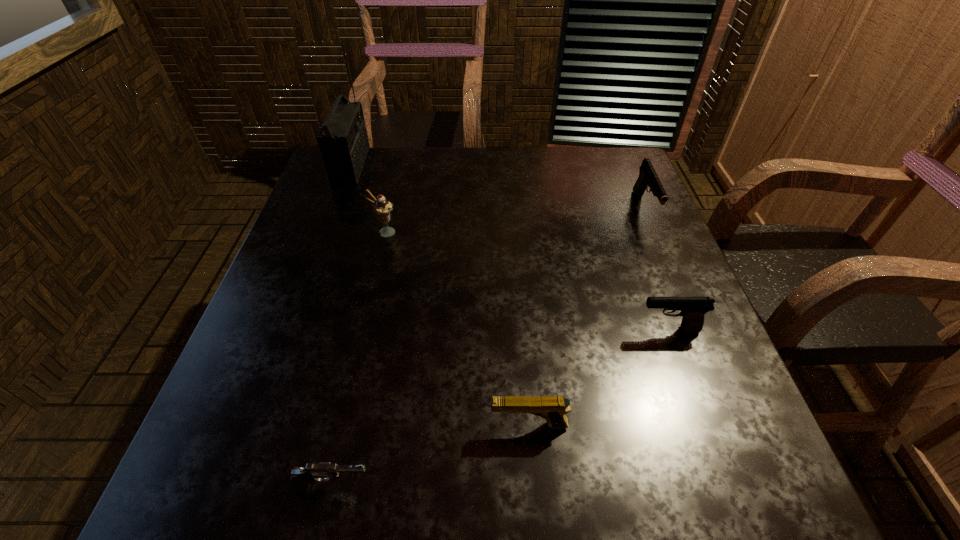
This screenshot has width=960, height=540. In order to click on the farthest object in this screenshot , I will do `click(343, 141)`.

Find the location of `the tallest object`. the tallest object is located at coordinates (343, 141).

At what (x,y) coordinates should I click in order to perform the action: click on icecream. Please return your answer as a coordinate pair (x, y). This screenshot has width=960, height=540. Looking at the image, I should click on (382, 207).

The image size is (960, 540). Identify the location of the farthest pistol. (647, 177).

Locate an element on the screen. The width and height of the screenshot is (960, 540). the third nearest object is located at coordinates (693, 309).

What are the coordinates of `the second nearest pistol` in the screenshot? It's located at (552, 408).

At what (x,y) coordinates should I click in order to perform the action: click on the second pistol from left to right. Please return your answer as a coordinate pair (x, y). Looking at the image, I should click on (552, 408).

In order to click on the nearest object in this screenshot , I will do `click(300, 479)`.

Identify the location of the leftmost pistol. The width and height of the screenshot is (960, 540). [x=300, y=479].

What are the coordinates of `free space located on the front panel of the farthest object` in the screenshot? It's located at (484, 165).